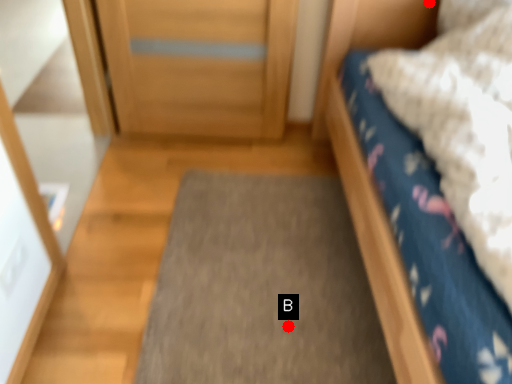
Question: Two points are circled on the image, labeled by A and B beside each circle. Which of the following is the farthest from the observer?

Choices:
 (A) A is further
 (B) B is further

Answer: (A)